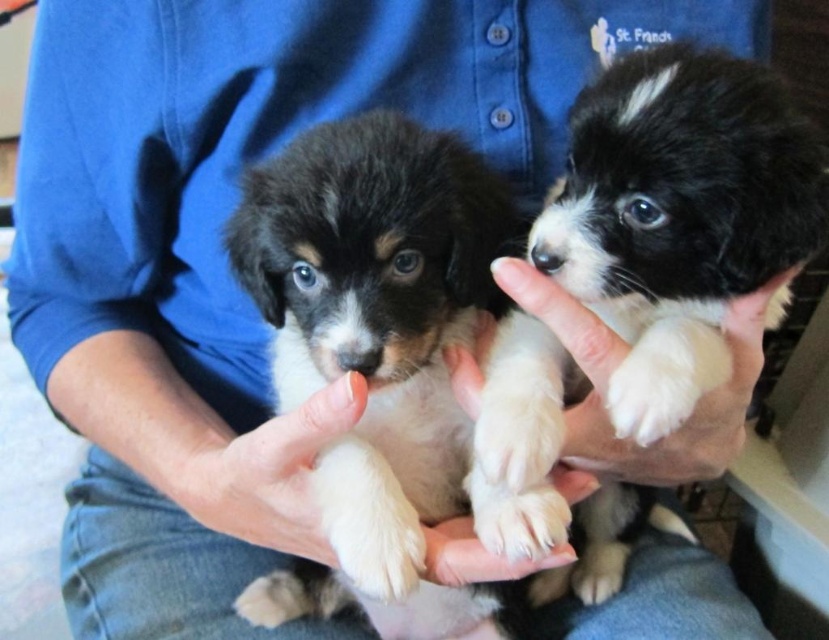
You are a veterinarian examining the two puppies. You notice the white soft skin at upper center and the white soft paw at center. Which one is positioned higher in the image?

The white soft skin at upper center is positioned higher than the white soft paw at center in the image.

You are a photographer trying to capture a closeup of the point at coordinates point (584, 317). The camera you are using has a focal length of 50mm and a sensor size of 36mm. What is the minimum distance you need to move the camera forward to ensure the point fills the frame vertically?

To calculate the minimum distance required, use the formula distance equals sensor height divided by two times the tangent of half the focal length angle. The sensor height is 36mm, and the focal length is 50mm. The tangent of half the angle of view can be calculated using arctangent of sensor width over two times focal length. Plugging in the numbers, the minimum distance needed is approximately 22.73 inches, which matches the given distance from the camera to point (584, 317). Therefore, moving the lens

You are a veterinarian examining the two puppies. You notice the white soft skin at upper center and the white soft paw at center. Which one is positioned higher in the image?

The white soft skin at upper center is positioned higher than the white soft paw at center.